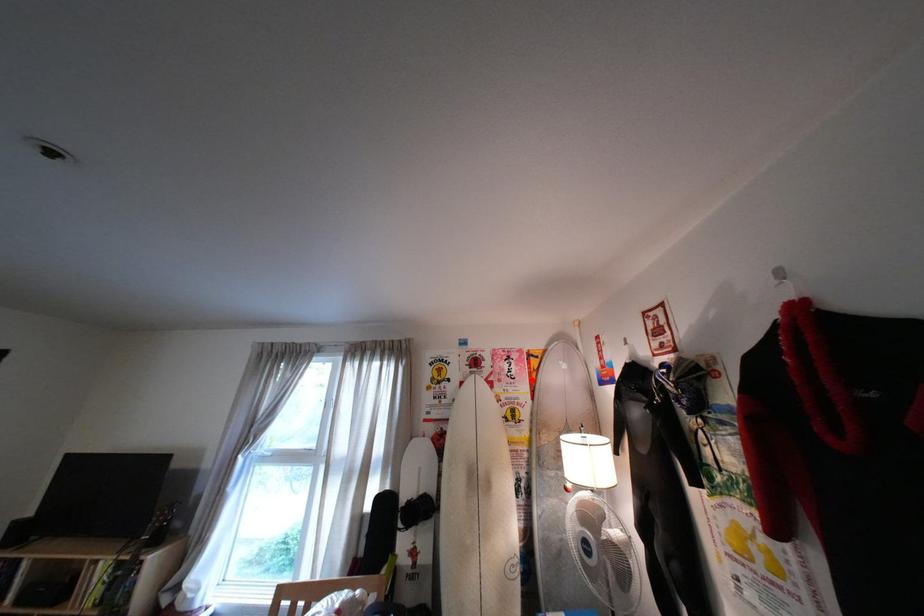
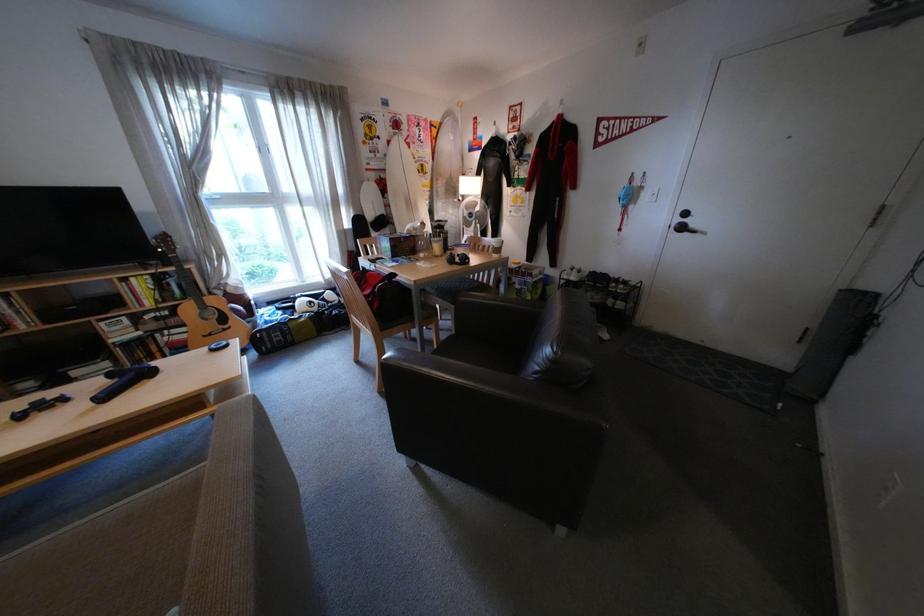
Find the pixel in the second image that matches the highlighted location in the first image.

(439, 145)